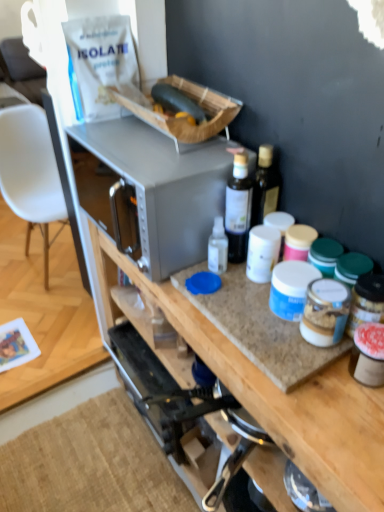
Question: From a real-world perspective, is white plastic chair at left on top of transparent plastic bottle at center?

Choices:
 (A) no
 (B) yes

Answer: (A)

Question: Is white plastic chair at left bigger than transparent plastic bottle at center?

Choices:
 (A) no
 (B) yes

Answer: (B)

Question: From the image's perspective, is white plastic chair at left under transparent plastic bottle at center?

Choices:
 (A) yes
 (B) no

Answer: (B)

Question: From a real-world perspective, is white plastic chair at left below transparent plastic bottle at center?

Choices:
 (A) yes
 (B) no

Answer: (A)

Question: Can you confirm if white plastic chair at left is taller than transparent plastic bottle at center?

Choices:
 (A) yes
 (B) no

Answer: (A)

Question: Are white plastic chair at left and transparent plastic bottle at center far apart?

Choices:
 (A) yes
 (B) no

Answer: (A)

Question: Is the position of transparent plastic bottle at center less distant than that of satin silver microwave at center?

Choices:
 (A) yes
 (B) no

Answer: (B)

Question: Could you tell me if transparent plastic bottle at center is facing satin silver microwave at center?

Choices:
 (A) yes
 (B) no

Answer: (B)

Question: Can you confirm if transparent plastic bottle at center is bigger than satin silver microwave at center?

Choices:
 (A) no
 (B) yes

Answer: (A)

Question: Is transparent plastic bottle at center not inside satin silver microwave at center?

Choices:
 (A) no
 (B) yes

Answer: (B)

Question: Is transparent plastic bottle at center smaller than satin silver microwave at center?

Choices:
 (A) yes
 (B) no

Answer: (A)

Question: Does transparent plastic bottle at center have a greater width compared to satin silver microwave at center?

Choices:
 (A) yes
 (B) no

Answer: (B)

Question: Can you confirm if granite countertop at center is bigger than green matte zucchini at upper center?

Choices:
 (A) no
 (B) yes

Answer: (B)